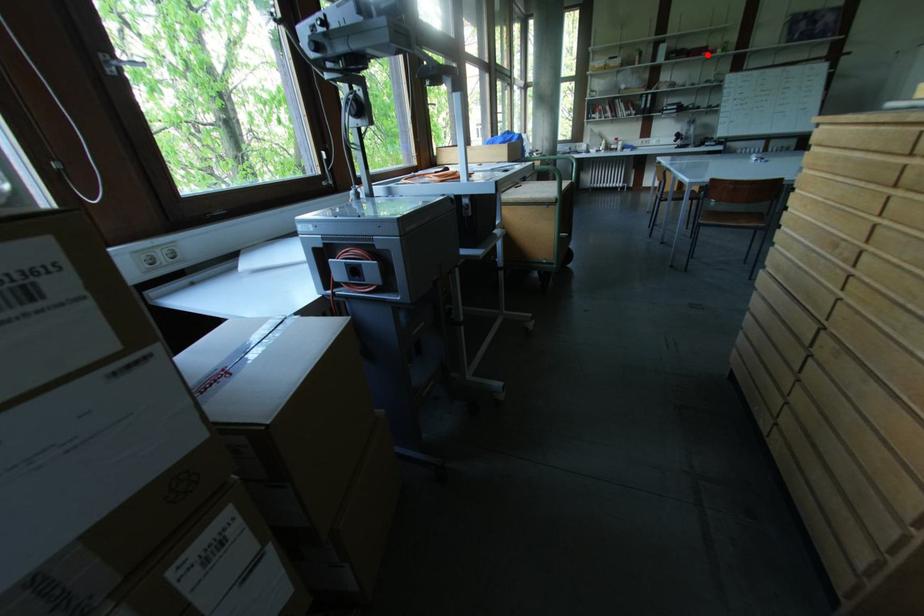
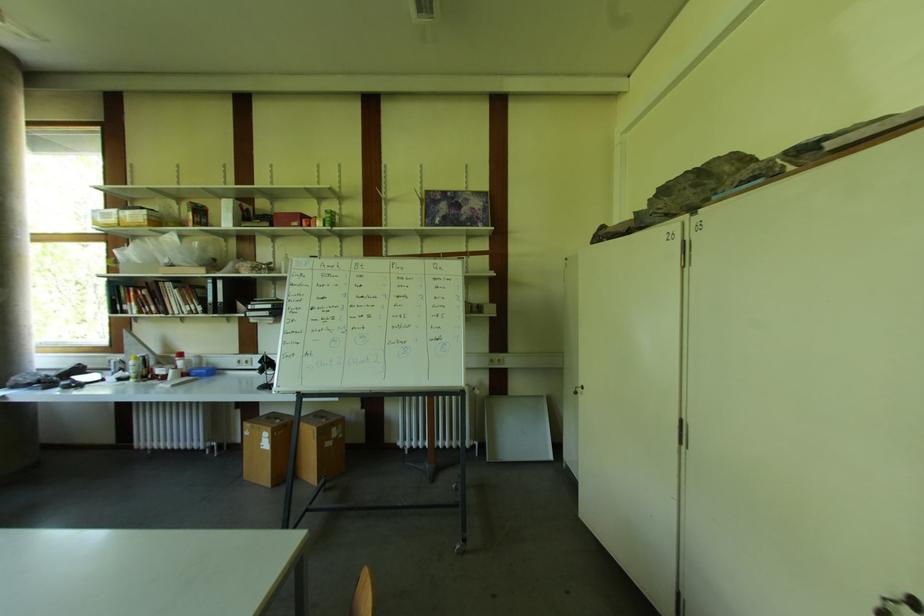
Question: I am providing you with two images of the same scene from different viewpoints. Given a red point in image1, look at the same physical point in image2. Is it:

Choices:
 (A) Closer to the viewpoint
 (B) Farther from the viewpoint

Answer: (A)